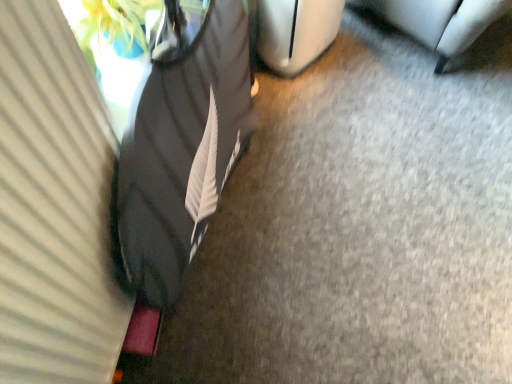
Question: From the image's perspective, would you say black fabric bean bag chair at left is shown under white matte curtain at left?

Choices:
 (A) yes
 (B) no

Answer: (B)

Question: Does black fabric bean bag chair at left have a smaller size compared to white matte curtain at left?

Choices:
 (A) no
 (B) yes

Answer: (A)

Question: Can you confirm if black fabric bean bag chair at left is taller than white matte curtain at left?

Choices:
 (A) yes
 (B) no

Answer: (A)

Question: Is black fabric bean bag chair at left far from white matte curtain at left?

Choices:
 (A) yes
 (B) no

Answer: (B)

Question: Considering the relative sizes of black fabric bean bag chair at left and white matte curtain at left in the image provided, is black fabric bean bag chair at left bigger than white matte curtain at left?

Choices:
 (A) no
 (B) yes

Answer: (B)

Question: Could you tell me if black fabric bean bag chair at left is turned towards white matte curtain at left?

Choices:
 (A) yes
 (B) no

Answer: (B)

Question: Does white matte curtain at left have a greater width compared to metallic silver trash can at lower right?

Choices:
 (A) yes
 (B) no

Answer: (B)

Question: Is white matte curtain at left shorter than metallic silver trash can at lower right?

Choices:
 (A) yes
 (B) no

Answer: (B)

Question: Can you see white matte curtain at left touching metallic silver trash can at lower right?

Choices:
 (A) yes
 (B) no

Answer: (B)

Question: From the image's perspective, is white matte curtain at left above metallic silver trash can at lower right?

Choices:
 (A) no
 (B) yes

Answer: (A)

Question: Would you say metallic silver trash can at lower right is part of white matte curtain at left's contents?

Choices:
 (A) yes
 (B) no

Answer: (B)

Question: Is the depth of white matte curtain at left greater than that of metallic silver trash can at lower right?

Choices:
 (A) no
 (B) yes

Answer: (A)

Question: Is metallic silver trash can at lower right positioned beyond the bounds of black fabric bean bag chair at left?

Choices:
 (A) no
 (B) yes

Answer: (B)